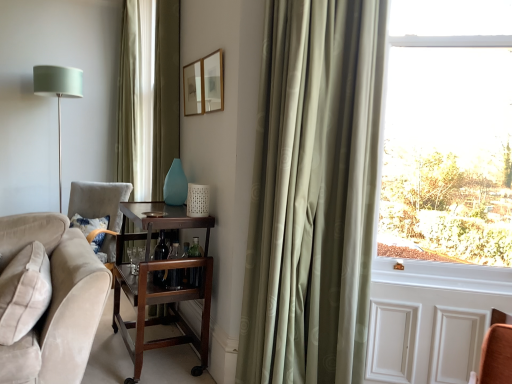
Question: Can you confirm if matte green shade at left is taller than transparent glass window at right?

Choices:
 (A) yes
 (B) no

Answer: (A)

Question: Is matte green shade at left located outside transparent glass window at right?

Choices:
 (A) yes
 (B) no

Answer: (A)

Question: Is matte green shade at left facing towards transparent glass window at right?

Choices:
 (A) no
 (B) yes

Answer: (A)

Question: Is matte green shade at left to the left of transparent glass window at right from the viewer's perspective?

Choices:
 (A) yes
 (B) no

Answer: (A)

Question: Is matte green shade at left shorter than transparent glass window at right?

Choices:
 (A) yes
 (B) no

Answer: (B)

Question: From their relative heights in the image, would you say satin green curtain at right is taller or shorter than velvet blue pillow at lower left?

Choices:
 (A) short
 (B) tall

Answer: (B)

Question: From the image's perspective, is satin green curtain at right positioned above or below velvet blue pillow at lower left?

Choices:
 (A) below
 (B) above

Answer: (B)

Question: Relative to velvet blue pillow at lower left, is satin green curtain at right in front or behind?

Choices:
 (A) behind
 (B) front

Answer: (B)

Question: Which is correct: satin green curtain at right is inside velvet blue pillow at lower left, or outside of it?

Choices:
 (A) inside
 (B) outside

Answer: (B)

Question: Relative to transparent glass window at right, is matte green shade at left in front or behind?

Choices:
 (A) behind
 (B) front

Answer: (A)

Question: In terms of height, does matte green shade at left look taller or shorter compared to transparent glass window at right?

Choices:
 (A) short
 (B) tall

Answer: (B)

Question: Based on their positions, is matte green shade at left located to the left or right of transparent glass window at right?

Choices:
 (A) left
 (B) right

Answer: (A)

Question: From the image's perspective, is matte green shade at left located above or below transparent glass window at right?

Choices:
 (A) above
 (B) below

Answer: (A)

Question: From their relative heights in the image, would you say teal glass vase at center is taller or shorter than mahogany wood bar cart at center?

Choices:
 (A) tall
 (B) short

Answer: (B)

Question: In terms of size, does teal glass vase at center appear bigger or smaller than mahogany wood bar cart at center?

Choices:
 (A) big
 (B) small

Answer: (B)